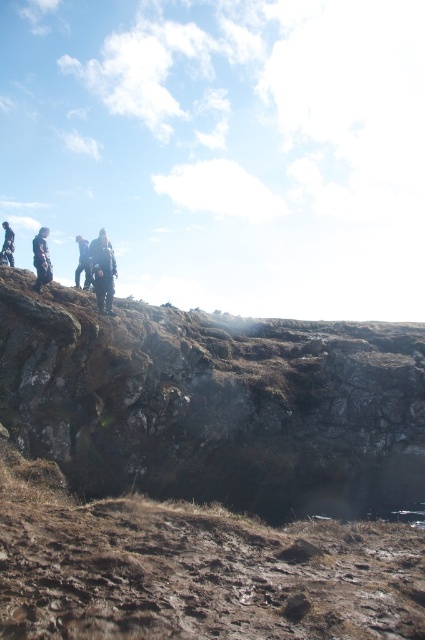
Looking at this image, is rough textured rock at center positioned before dark gray clothing at left?

Yes, rough textured rock at center is closer to the viewer.

Is rough textured rock at center bigger than dark gray clothing at left?

Yes, rough textured rock at center is bigger than dark gray clothing at left.

Locate an element on the screen. This screenshot has height=640, width=425. rough textured rock at center is located at coordinates (214, 403).

Is point (254, 413) behind point (113, 276)?

Yes, it is.

Does rough textured rock at center appear under dark blue jacket at upper center?

Yes, rough textured rock at center is below dark blue jacket at upper center.

The height and width of the screenshot is (640, 425). What are the coordinates of `rough textured rock at center` in the screenshot? It's located at (214, 403).

Is point (108, 250) positioned before point (13, 241)?

Yes, point (108, 250) is in front of point (13, 241).

I want to click on dark blue jacket at upper center, so click(102, 269).

The height and width of the screenshot is (640, 425). I want to click on dark blue jacket at upper center, so click(102, 269).